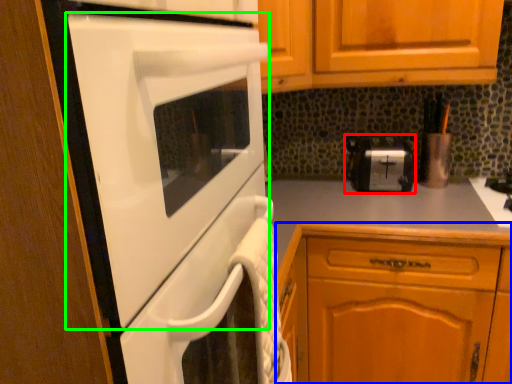
Question: Which object is positioned farthest from toaster (highlighted by a red box)? Select from cabinetry (highlighted by a blue box) and home appliance (highlighted by a green box).

Choices:
 (A) cabinetry
 (B) home appliance

Answer: (B)